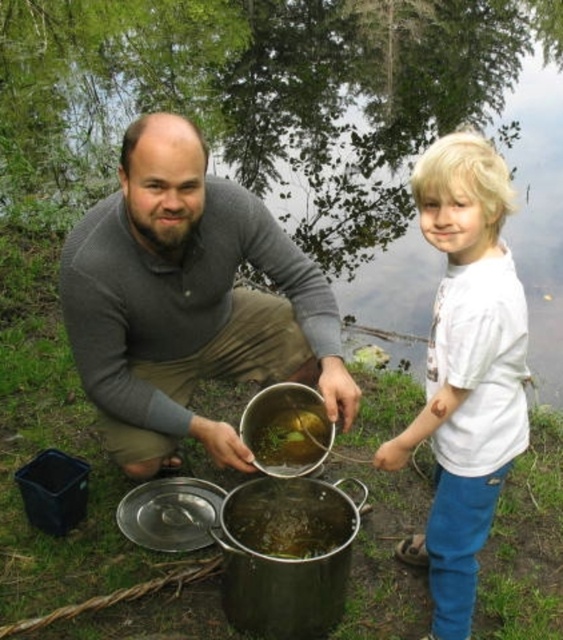
Can you confirm if slightly browned metal pot at center is thinner than green matte pot at center?

No, slightly browned metal pot at center is not thinner than green matte pot at center.

Is the position of slightly browned metal pot at center less distant than that of green matte pot at center?

No, slightly browned metal pot at center is further to the viewer.

Does point (343, 515) come closer to viewer compared to point (269, 426)?

Yes, point (343, 515) is in front of point (269, 426).

Where is `slightly browned metal pot at center`? The width and height of the screenshot is (563, 640). slightly browned metal pot at center is located at coordinates (287, 525).

Can you confirm if white cotton shirt at right is positioned below slightly browned metal pot at center?

No.

Between white cotton shirt at right and slightly browned metal pot at center, which one is positioned lower?

slightly browned metal pot at center is lower down.

Does point (484, 202) come farther from viewer compared to point (243, 529)?

That is False.

Identify the location of white cotton shirt at right. The image size is (563, 640). (466, 369).

Does matte gray sweater at center have a smaller size compared to white cotton shirt at right?

Actually, matte gray sweater at center might be larger than white cotton shirt at right.

Who is positioned more to the right, matte gray sweater at center or white cotton shirt at right?

Positioned to the right is white cotton shirt at right.

Identify the location of matte gray sweater at center. (187, 300).